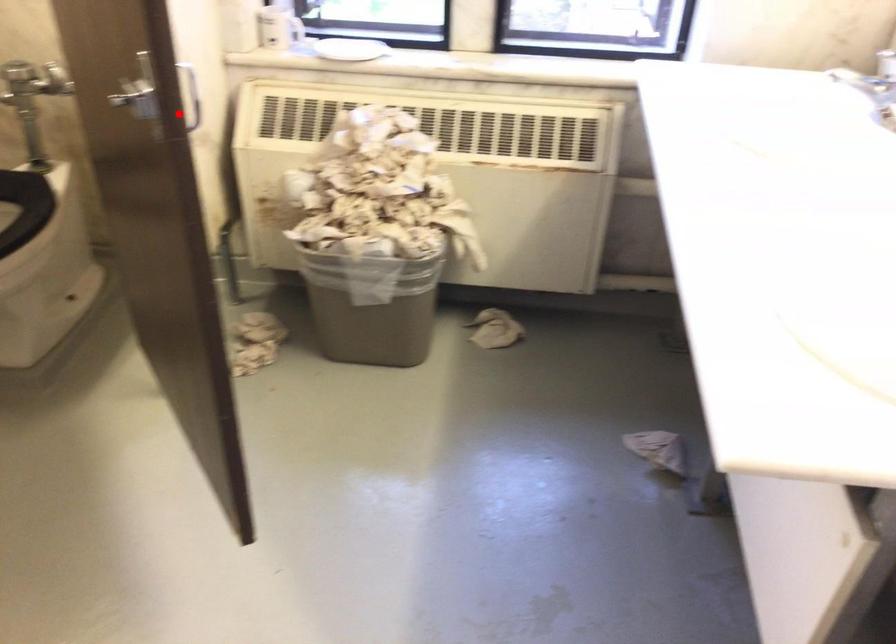
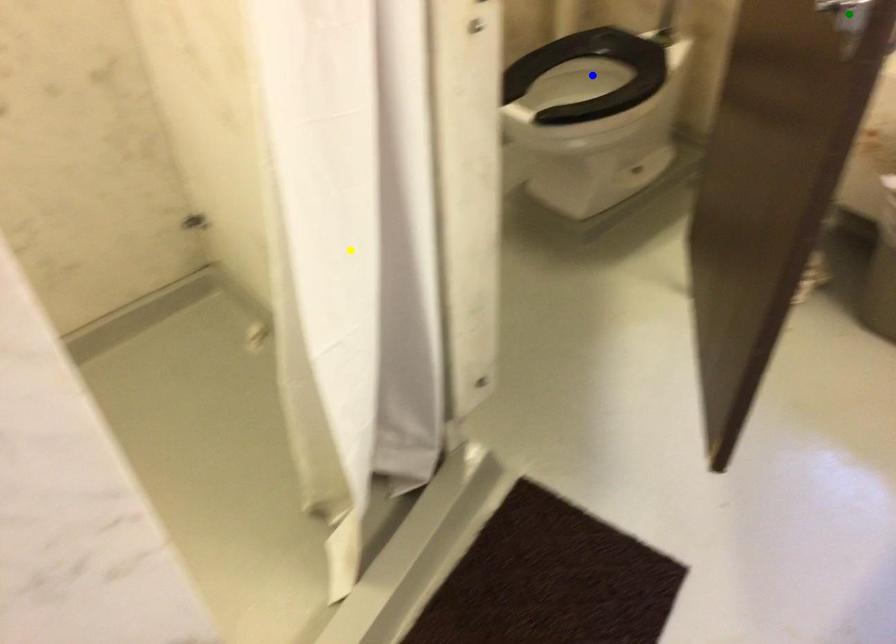
Question: I am providing you with two images of the same scene from different viewpoints. A red point is marked on the first image. You are given multiple points on the second image. Which point in image 2 represents the same 3d spot as the red point in image 1?

Choices:
 (A) green point
 (B) yellow point
 (C) blue point

Answer: (A)